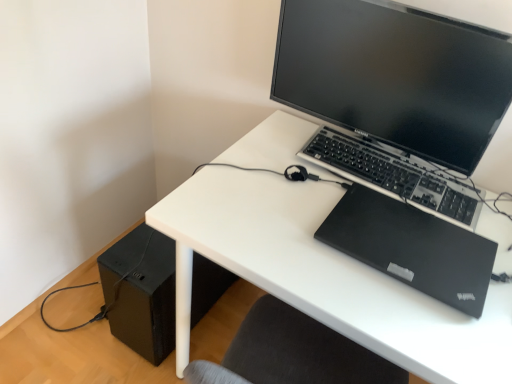
Find the location of a particular element. The width and height of the screenshot is (512, 384). vacant space in front of matte black monitor at upper center is located at coordinates (320, 243).